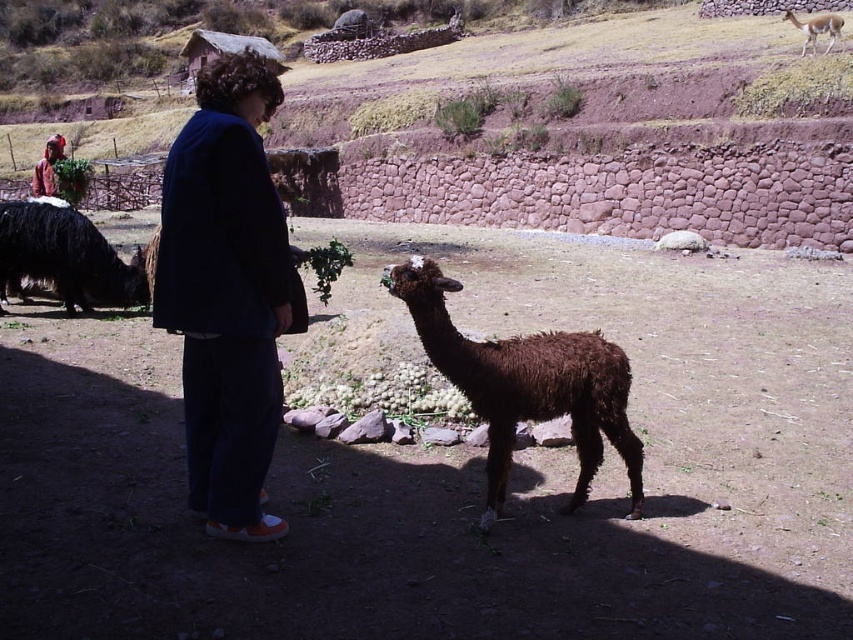
You are a farmer who wants to build a fence around the area where the brown woolly alpaca at center and the light brown fur camel at upper right are located. Based on their sizes, which animal requires a taller fence to prevent them from jumping over?

The light brown fur camel at upper right requires a taller fence since it is taller than the brown woolly alpaca at center according to the description.

You are a visitor at this mountainous area and want to take a photo of the rustic stone wall at upper center and the dark blue fabric at center. Which object should you focus on first to ensure both are in the frame?

You should focus on the dark blue fabric at center first because the rustic stone wall at upper center is positioned over it, so adjusting the camera to include the lower object will naturally include the one above.

You are a hiker who just arrived at this mountain area. You need to decide whether to place your tent between the rustic stone wall at upper center and the black woolen llama at left. Can you fit your tent there if the tent requires 2 meters of space?

The rustic stone wall at upper center might be wider than black woolen llama at left, but without exact measurements, it is uncertain if the space between them is sufficient for a 2 meter tent. Check the distance carefully before setting up.